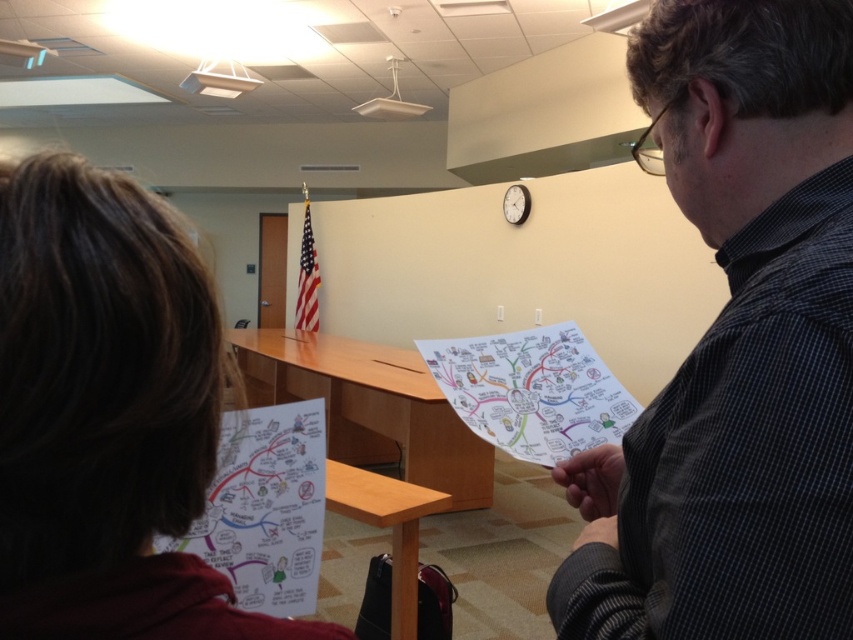
You are standing at the center of the room and want to reach the white paper map at lower left located at point (265, 508). Is there a clear path to it without moving any objects?

The white paper map at lower left is located at point (265, 508), so yes, there is a clear path to it without moving any objects.

You are standing in the office scene described. You need to locate the white paper map at lower left. According to the coordinates provided, where exactly is it positioned?

The white paper map at lower left is positioned at coordinates point [265,508].